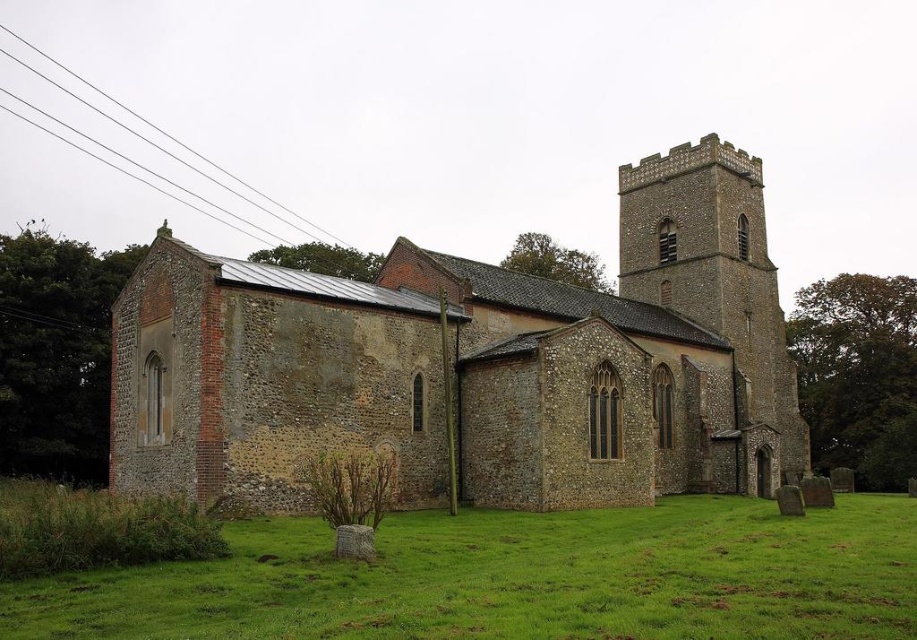
Is point (721, 496) less distant than point (713, 250)?

That is True.

Is green grass at lower center in front of brown stone church tower at upper right?

Yes.

Locate an element on the screen. This screenshot has width=917, height=640. green grass at lower center is located at coordinates (516, 579).

Identify the location of green grass at lower center. The height and width of the screenshot is (640, 917). (516, 579).

Does brown stone church at center appear on the left side of green grass at lower center?

Correct, you'll find brown stone church at center to the left of green grass at lower center.

Is point (113, 358) positioned behind point (656, 588)?

Yes, point (113, 358) is farther from viewer.

This screenshot has height=640, width=917. Describe the element at coordinates (474, 362) in the screenshot. I see `brown stone church at center` at that location.

I want to click on brown stone church at center, so click(474, 362).

Find the location of a particular element. The image size is (917, 640). brown stone church at center is located at coordinates (474, 362).

Which is more to the left, brown stone church at center or brown stone church tower at upper right?

brown stone church at center is more to the left.

Locate an element on the screen. The image size is (917, 640). brown stone church at center is located at coordinates (474, 362).

This screenshot has width=917, height=640. I want to click on brown stone church at center, so click(474, 362).